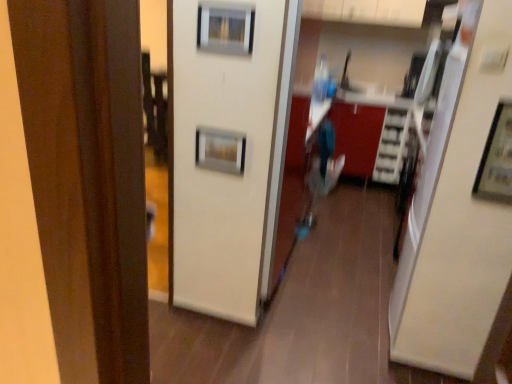
Question: Would you say white glossy cabinet at upper center is to the left or to the right of metallic silver picture frame at center, the third picture frame viewed from the right, in the picture?

Choices:
 (A) left
 (B) right

Answer: (B)

Question: From the image's perspective, is white glossy cabinet at upper center located above or below metallic silver picture frame at center, the 3th picture frame viewed from the front?

Choices:
 (A) above
 (B) below

Answer: (A)

Question: Which is farther from the metallic silver picture frame at upper right, the 1th picture frame in the right-to-left sequence?

Choices:
 (A) white glossy cabinet at upper center
 (B) metallic silver picture frame at upper center, the 2th picture frame when ordered from front to back
 (C) metallic silver picture frame at center, the 2th picture frame in the top-to-bottom sequence

Answer: (A)

Question: Which of these objects is positioned farthest from the metallic silver picture frame at upper right, the third picture frame positioned from the back?

Choices:
 (A) metallic silver picture frame at upper center, the 3th picture frame in the bottom-to-top sequence
 (B) metallic silver picture frame at center, the second picture frame in the bottom-to-top sequence
 (C) white glossy cabinet at upper center

Answer: (C)